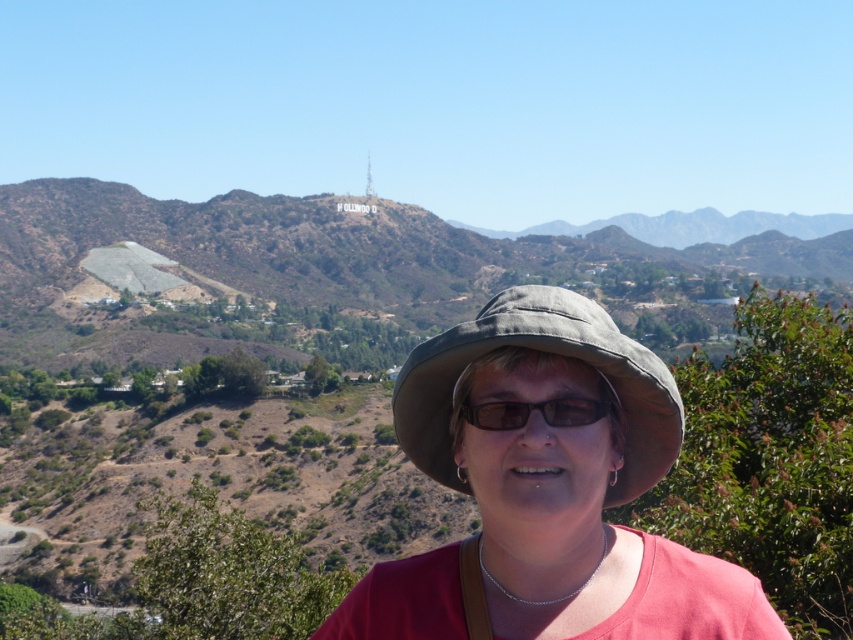
You are a photographer trying to capture the Hollywood sign in the background while ensuring the person in the foreground is visible. Which object in the scene, the green grassy hillside at upper center or the brown matte glasses at center, would you adjust your focus to include more in the photo?

The green grassy hillside at upper center is bigger than the brown matte glasses at center, so adjusting focus to include more of the green grassy hillside at upper center would naturally draw attention to the larger element in the scene.

You are standing at the base of the hill and want to take a photo of the Hollywood sign located on the green grassy hillside at upper center. If your camera has a maximum zoom range of 100 meters, will you be able to capture the Hollywood sign clearly in your photo?

The green grassy hillside at upper center is 313.18 meters away from the viewer. Since the camera can only zoom up to 100 meters, it will not be sufficient to capture the Hollywood sign clearly from this distance.